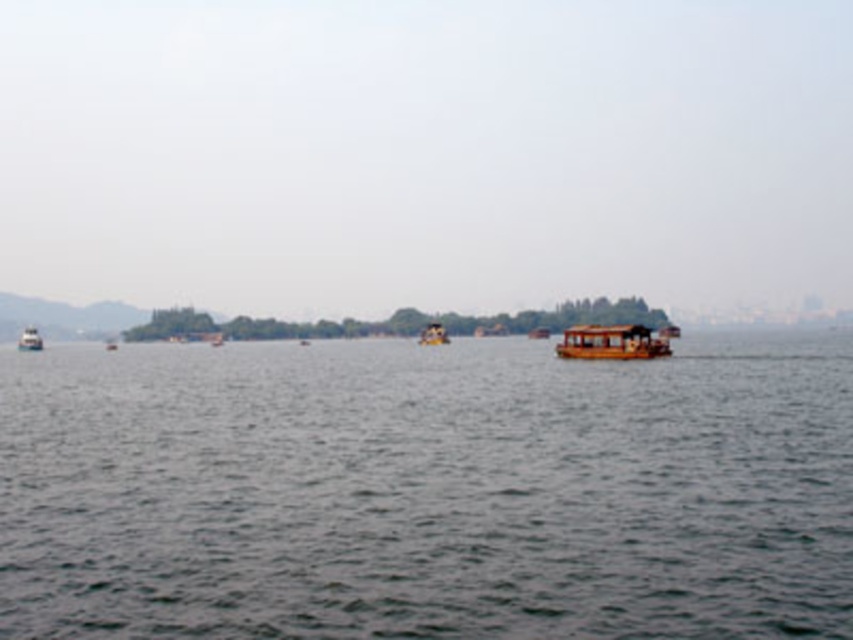
Question: Among these points, which one is nearest to the camera?

Choices:
 (A) (523, 422)
 (B) (28, 346)
 (C) (424, 337)
 (D) (564, 333)

Answer: (A)

Question: Which point is closer to the camera taking this photo?

Choices:
 (A) (646, 348)
 (B) (32, 333)

Answer: (A)

Question: Which point is farther from the camera taking this photo?

Choices:
 (A) (422, 346)
 (B) (608, 332)

Answer: (A)

Question: Observing the image, what is the correct spatial positioning of dark gray water at center in reference to wooden boat at right?

Choices:
 (A) below
 (B) above

Answer: (A)

Question: Is dark gray water at center to the right of wooden boat at left from the viewer's perspective?

Choices:
 (A) no
 (B) yes

Answer: (B)

Question: Can you confirm if wooden boat at center is positioned to the left of wooden boat at left?

Choices:
 (A) no
 (B) yes

Answer: (A)